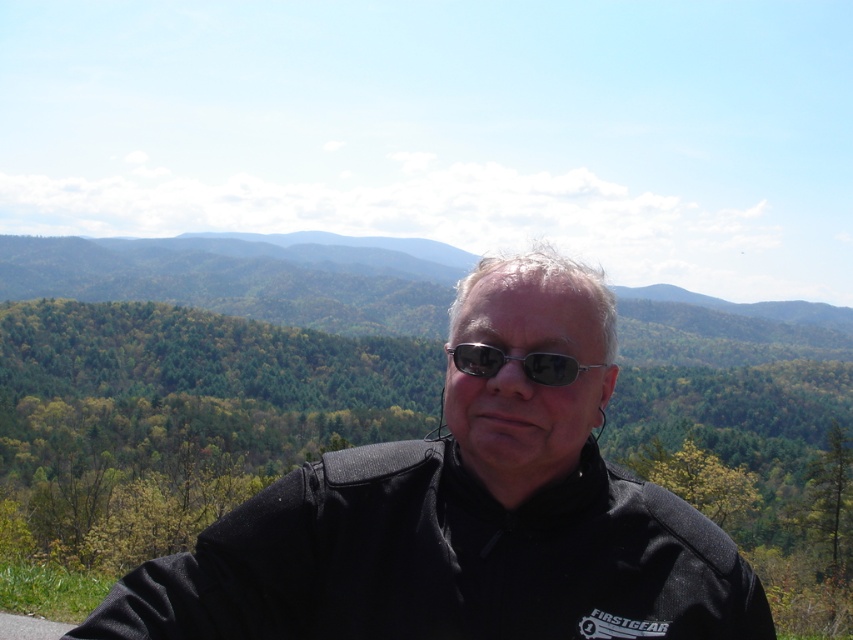
Consider the image. Between black matte jacket at center and metallic frame sunglasses at center, which one has more height?

black matte jacket at center

Can you confirm if black matte jacket at center is positioned above metallic frame sunglasses at center?

No, black matte jacket at center is not above metallic frame sunglasses at center.

Who is more forward, (560, 403) or (477, 342)?

Point (477, 342) is more forward.

You are a GUI agent. You are given a task and a screenshot of the screen. Output one action in this format:
    pyautogui.click(x=<x>, y=<y>)
    Task: Click on the black matte jacket at center
    This screenshot has width=853, height=640.
    Given the screenshot: What is the action you would take?
    pyautogui.click(x=463, y=513)